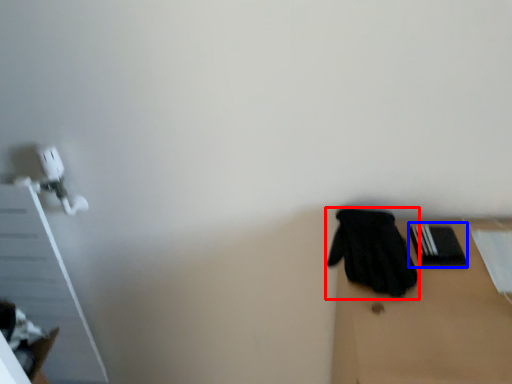
Question: Which object appears closest to the camera in this image, glove (highlighted by a red box) or bin (highlighted by a blue box)?

Choices:
 (A) glove
 (B) bin

Answer: (A)